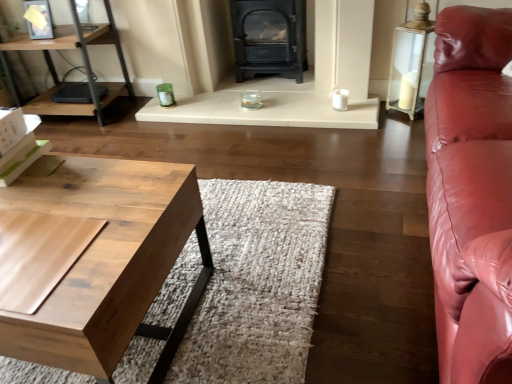
What do you see at coordinates (108, 261) in the screenshot? I see `natural wood coffee table at lower left` at bounding box center [108, 261].

Image resolution: width=512 pixels, height=384 pixels. What are the coordinates of `natural wood coffee table at lower left` in the screenshot? It's located at (108, 261).

Image resolution: width=512 pixels, height=384 pixels. In order to click on wooden desk at left in this screenshot , I will do `click(83, 61)`.

Is black cast iron fireplace at center outside of natural wood coffee table at lower left?

black cast iron fireplace at center lies outside natural wood coffee table at lower left's area.

Looking at this image, is black cast iron fireplace at center positioned with its back to natural wood coffee table at lower left?

No, black cast iron fireplace at center is not facing away from natural wood coffee table at lower left.

From the image's perspective, is black cast iron fireplace at center above natural wood coffee table at lower left?

Yes.

Which is more to the left, black cast iron fireplace at center or natural wood coffee table at lower left?

From the viewer's perspective, natural wood coffee table at lower left appears more on the left side.

From a real-world perspective, who is located higher, natural wood coffee table at lower left or wooden desk at left?

In real-world perspective, wooden desk at left is above.

Which object is positioned more to the right, natural wood coffee table at lower left or wooden desk at left?

From the viewer's perspective, natural wood coffee table at lower left appears more on the right side.

Considering the points (157, 201) and (17, 103), which point is in front, point (157, 201) or point (17, 103)?

The point (157, 201) is closer to the camera.

Is natural wood coffee table at lower left aimed at wooden desk at left?

Yes, natural wood coffee table at lower left is oriented towards wooden desk at left.

How far apart are natural wood coffee table at lower left and black cast iron fireplace at center?

natural wood coffee table at lower left and black cast iron fireplace at center are 1.40 meters apart from each other.

In the scene shown: Is natural wood coffee table at lower left smaller than black cast iron fireplace at center?

Incorrect, natural wood coffee table at lower left is not smaller in size than black cast iron fireplace at center.

Does natural wood coffee table at lower left lie in front of black cast iron fireplace at center?

Yes, the depth of natural wood coffee table at lower left is less than that of black cast iron fireplace at center.

Does natural wood coffee table at lower left turn towards black cast iron fireplace at center?

Yes, natural wood coffee table at lower left faces towards black cast iron fireplace at center.

Is matte black wood burning stove at center looking in the opposite direction of black cast iron fireplace at center?

Correct, matte black wood burning stove at center is looking away from black cast iron fireplace at center.

Is matte black wood burning stove at center wider than black cast iron fireplace at center?

Indeed, matte black wood burning stove at center has a greater width compared to black cast iron fireplace at center.

Where is `wood burning stove below the black cast iron fireplace at center (from a real-world perspective)`? This screenshot has width=512, height=384. wood burning stove below the black cast iron fireplace at center (from a real-world perspective) is located at coordinates (269, 38).

Is matte black wood burning stove at center with black cast iron fireplace at center?

matte black wood burning stove at center is not next to black cast iron fireplace at center, and they're not touching.

Considering the sizes of wooden desk at left and matte black wood burning stove at center in the image, is wooden desk at left bigger or smaller than matte black wood burning stove at center?

Clearly, wooden desk at left is larger in size than matte black wood burning stove at center.

Would you say wooden desk at left is outside matte black wood burning stove at center?

Indeed, wooden desk at left is completely outside matte black wood burning stove at center.

From a real-world perspective, is wooden desk at left over matte black wood burning stove at center?

Correct, in the physical world, wooden desk at left is higher than matte black wood burning stove at center.

Which point is more distant from viewer, (49,45) or (303,59)?

The point (303,59) is more distant.

Considering the relative positions of wooden desk at left and black cast iron fireplace at center in the image provided, is wooden desk at left to the left or to the right of black cast iron fireplace at center?

Based on their positions, wooden desk at left is located to the left of black cast iron fireplace at center.

Which is in front, wooden desk at left or black cast iron fireplace at center?

black cast iron fireplace at center is more forward.

Who is smaller, wooden desk at left or black cast iron fireplace at center?

black cast iron fireplace at center.

From a real-world perspective, who is located lower, wooden desk at left or black cast iron fireplace at center?

black cast iron fireplace at center.

Would you say matte black wood burning stove at center is a long distance from natural wood coffee table at lower left?

Indeed, matte black wood burning stove at center is not near natural wood coffee table at lower left.

Consider the image. Considering the sizes of matte black wood burning stove at center and natural wood coffee table at lower left in the image, is matte black wood burning stove at center taller or shorter than natural wood coffee table at lower left?

matte black wood burning stove at center is taller than natural wood coffee table at lower left.

Does matte black wood burning stove at center have a greater width compared to natural wood coffee table at lower left?

In fact, matte black wood burning stove at center might be narrower than natural wood coffee table at lower left.

Can you confirm if matte black wood burning stove at center is positioned to the left of natural wood coffee table at lower left?

Incorrect, matte black wood burning stove at center is not on the left side of natural wood coffee table at lower left.

This screenshot has height=384, width=512. I want to click on coffee table on the left of black cast iron fireplace at center, so click(108, 261).

Identify the location of coffee table that appears below the wooden desk at left (from a real-world perspective). (108, 261).

Based on their spatial positions, is wooden desk at left or matte black wood burning stove at center closer to natural wood coffee table at lower left?

wooden desk at left lies closer to natural wood coffee table at lower left than the other object.

When comparing their distances from matte black wood burning stove at center, does natural wood coffee table at lower left or black cast iron fireplace at center seem closer?

Based on the image, black cast iron fireplace at center appears to be nearer to matte black wood burning stove at center.

Estimate the real-world distances between objects in this image. Which object is further from black cast iron fireplace at center, wooden desk at left or natural wood coffee table at lower left?

Among the two, natural wood coffee table at lower left is located further to black cast iron fireplace at center.

When comparing their distances from wooden desk at left, does black cast iron fireplace at center or matte black wood burning stove at center seem closer?

black cast iron fireplace at center lies closer to wooden desk at left than the other object.

Looking at the image, which one is located closer to black cast iron fireplace at center, matte black wood burning stove at center or natural wood coffee table at lower left?

matte black wood burning stove at center.

When comparing their distances from black cast iron fireplace at center, does wooden desk at left or matte black wood burning stove at center seem further?

Based on the image, wooden desk at left appears to be further to black cast iron fireplace at center.

Considering their positions, is black cast iron fireplace at center positioned further to matte black wood burning stove at center than natural wood coffee table at lower left?

natural wood coffee table at lower left lies further to matte black wood burning stove at center than the other object.

When comparing their distances from wooden desk at left, does matte black wood burning stove at center or natural wood coffee table at lower left seem closer?

matte black wood burning stove at center lies closer to wooden desk at left than the other object.

Image resolution: width=512 pixels, height=384 pixels. Find the location of `fireplace between wooden desk at left and matte black wood burning stove at center in the horizontal direction`. fireplace between wooden desk at left and matte black wood burning stove at center in the horizontal direction is located at coordinates (298, 84).

Locate an element on the screen. shelf between natural wood coffee table at lower left and matte black wood burning stove at center in the front-back direction is located at coordinates (83, 61).

What are the coordinates of `fireplace positioned between natural wood coffee table at lower left and wooden desk at left from near to far` in the screenshot? It's located at (298, 84).

I want to click on fireplace positioned between natural wood coffee table at lower left and matte black wood burning stove at center from near to far, so click(298, 84).